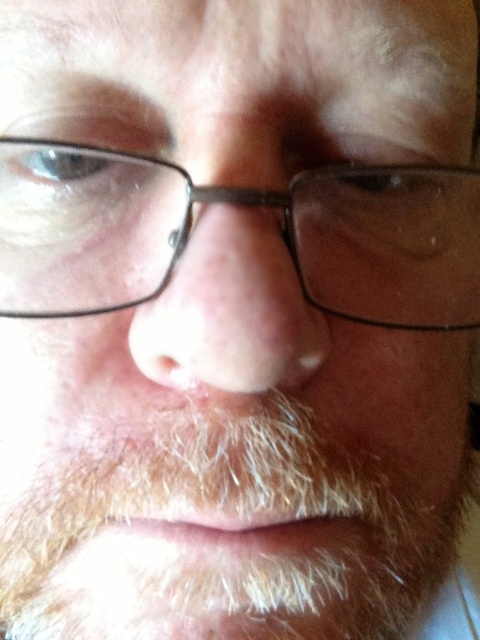
Question: Among these objects, which one is farthest from the camera?

Choices:
 (A) smooth skin nose at center
 (B) white fuzzy beard at lower center
 (C) black plastic glasses at center

Answer: (B)

Question: Is white fuzzy beard at lower center further to the viewer compared to smooth skin nose at center?

Choices:
 (A) no
 (B) yes

Answer: (B)

Question: Is white fuzzy beard at lower center below smooth skin nose at center?

Choices:
 (A) yes
 (B) no

Answer: (A)

Question: Which object appears farthest from the camera in this image?

Choices:
 (A) black plastic glasses at center
 (B) smooth skin nose at center

Answer: (A)

Question: Considering the relative positions of white fuzzy beard at lower center and smooth skin nose at center in the image provided, where is white fuzzy beard at lower center located with respect to smooth skin nose at center?

Choices:
 (A) left
 (B) right

Answer: (B)

Question: Which object is farther from the camera taking this photo?

Choices:
 (A) black plastic glasses at center
 (B) white fuzzy beard at lower center
 (C) smooth skin nose at center

Answer: (B)